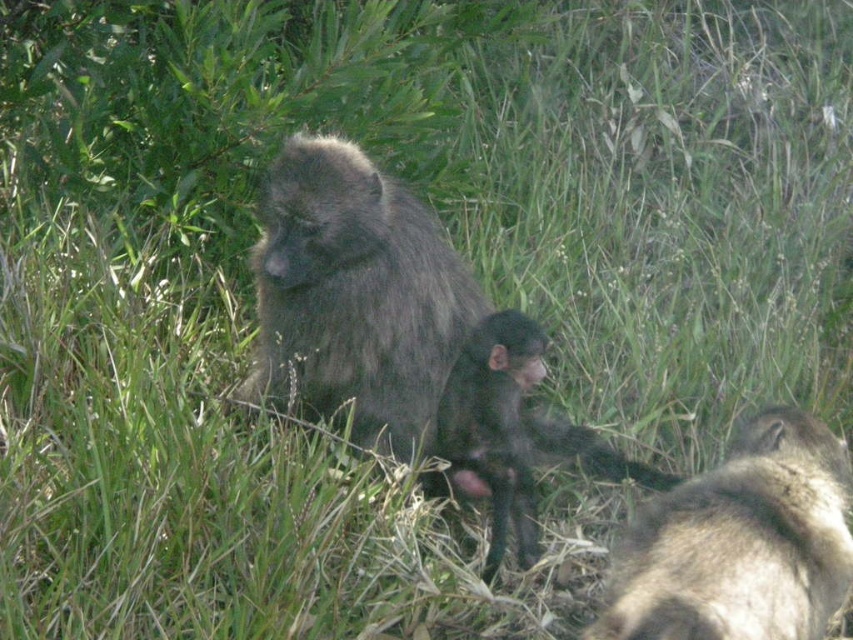
You are a wildlife photographer observing the scene. You need to capture a photo where the dark gray fur monkey at center and the fuzzy brown monkey at lower right are both clearly visible. Based on their sizes, which monkey should you focus on first to ensure both are in frame?

The dark gray fur monkey at center is larger than the fuzzy brown monkey at lower right. To ensure both are in frame, focus on the larger dark gray fur monkey at center first, then adjust the camera to include the smaller fuzzy brown monkey at lower right.

You are a wildlife photographer aiming to capture a closeup shot of the dark gray fur monkey at center and the shiny black monkey at center. Based on their sizes, which monkey would require a wider lens to ensure it fits entirely in the frame?

The dark gray fur monkey at center is larger in size than the shiny black monkey at center, so the dark gray fur monkey at center would require a wider lens to ensure it fits entirely in the frame.